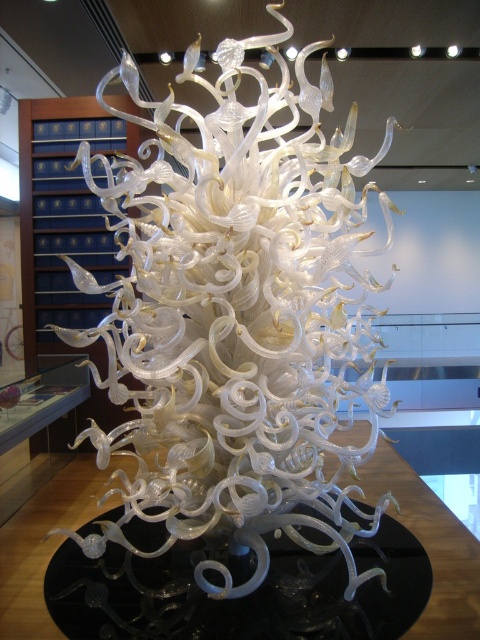
Question: Does translucent glass sculpture at center have a lesser width compared to black glass table at center?

Choices:
 (A) yes
 (B) no

Answer: (A)

Question: Is translucent glass sculpture at center above black glass table at center?

Choices:
 (A) yes
 (B) no

Answer: (A)

Question: Which point appears closest to the camera in this image?

Choices:
 (A) pos(127,614)
 (B) pos(189,396)

Answer: (A)

Question: Is translucent glass sculpture at center wider than black glass table at center?

Choices:
 (A) no
 (B) yes

Answer: (A)

Question: Which object is farther from the camera taking this photo?

Choices:
 (A) black glass table at center
 (B) translucent glass sculpture at center

Answer: (A)

Question: Which point is farther to the camera?

Choices:
 (A) (240, 65)
 (B) (372, 596)

Answer: (B)